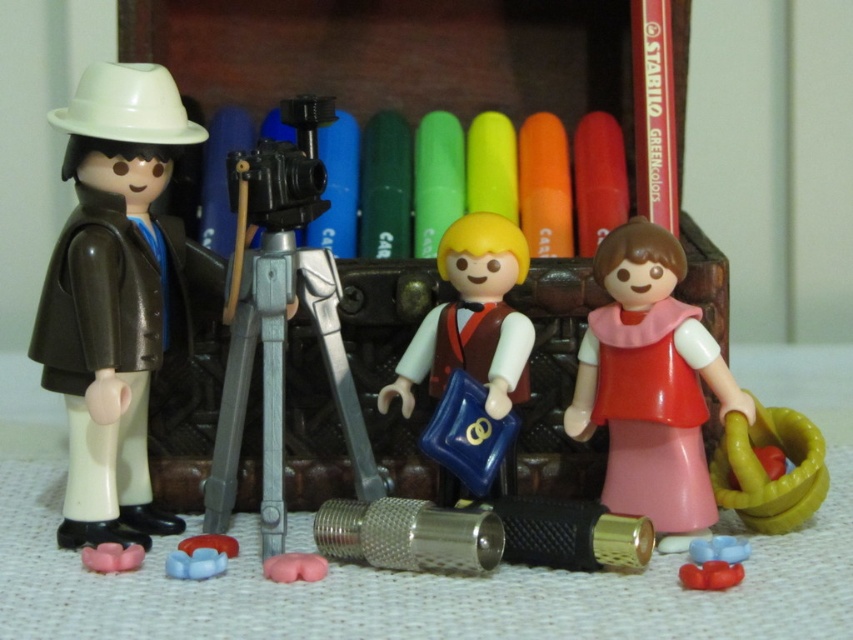
Question: Considering the relative positions of white matte vest at center and rubber yellow hoop at right in the image provided, where is white matte vest at center located with respect to rubber yellow hoop at right?

Choices:
 (A) below
 (B) above

Answer: (B)

Question: Does pink matte dress at center appear under rubber yellow hoop at right?

Choices:
 (A) yes
 (B) no

Answer: (B)

Question: Which object appears closest to the camera in this image?

Choices:
 (A) rubber yellow hoop at right
 (B) matte brown coat at left

Answer: (B)

Question: Which of the following is the farthest from the observer?

Choices:
 (A) white matte vest at center
 (B) rubber yellow hoop at right
 (C) orange matte crayon at center
 (D) pink matte dress at center

Answer: (C)

Question: Which point appears farthest from the camera in this image?

Choices:
 (A) pyautogui.click(x=140, y=250)
 (B) pyautogui.click(x=621, y=266)
 (C) pyautogui.click(x=317, y=179)

Answer: (A)

Question: Observing the image, what is the correct spatial positioning of silver metallic tripod at center in reference to orange matte crayon at center?

Choices:
 (A) left
 (B) right

Answer: (A)